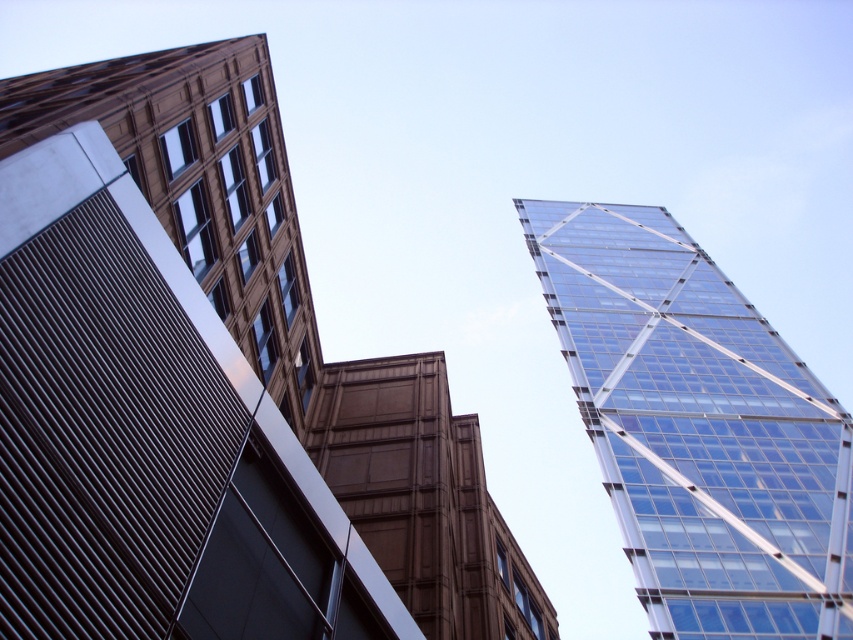
Question: Observing the image, what is the correct spatial positioning of transparent glass tower at upper right in reference to brown textured building at center?

Choices:
 (A) right
 (B) left

Answer: (A)

Question: Estimate the real-world distances between objects in this image. Which object is farther from the transparent glass skyscraper at upper right?

Choices:
 (A) brown textured building at center
 (B) transparent glass tower at upper right

Answer: (B)

Question: From the image, what is the correct spatial relationship of transparent glass skyscraper at upper right in relation to brown textured building at center?

Choices:
 (A) below
 (B) above

Answer: (B)

Question: Which point is closer to the camera?

Choices:
 (A) brown textured building at center
 (B) transparent glass skyscraper at upper right

Answer: (B)

Question: Can you confirm if transparent glass tower at upper right is thinner than brown textured building at center?

Choices:
 (A) no
 (B) yes

Answer: (A)

Question: Which point is closer to the camera?

Choices:
 (A) transparent glass tower at upper right
 (B) transparent glass skyscraper at upper right

Answer: (B)